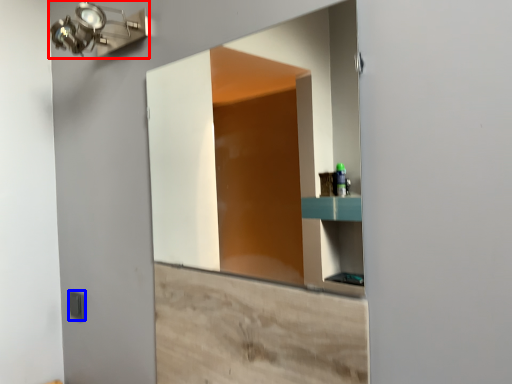
Question: Which object appears closest to the camera in this image, light fixture (highlighted by a red box) or light switch (highlighted by a blue box)?

Choices:
 (A) light fixture
 (B) light switch

Answer: (A)